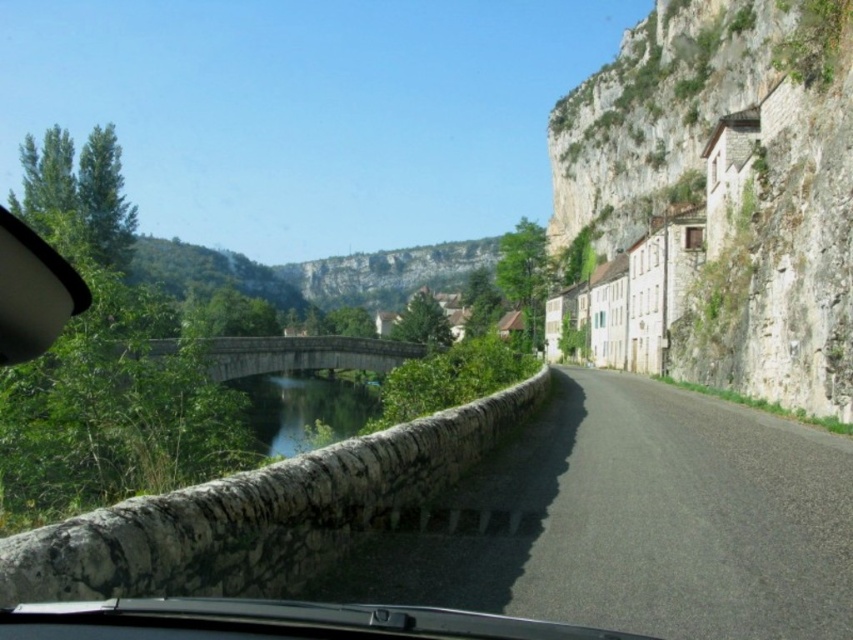
Between white stone houses at right and stone bridge at center, which one is positioned lower?

stone bridge at center

Can you confirm if white stone houses at right is bigger than stone bridge at center?

Indeed, white stone houses at right has a larger size compared to stone bridge at center.

Who is more distant from viewer, (763, 388) or (210, 372)?

The point (763, 388) is more distant.

Where is `white stone houses at right`? white stone houses at right is located at coordinates (727, 189).

Find the location of a particular element. The image size is (853, 640). clear water at bridge center is located at coordinates (303, 410).

Image resolution: width=853 pixels, height=640 pixels. Describe the element at coordinates (303, 410) in the screenshot. I see `clear water at bridge center` at that location.

Based on the photo, who is more distant from viewer, (347, 419) or (248, 337)?

Point (248, 337)

What are the coordinates of `clear water at bridge center` in the screenshot? It's located at (303, 410).

Between asphalt road at center and stone bridge at center, which one has less height?

asphalt road at center

Who is taller, asphalt road at center or stone bridge at center?

stone bridge at center is taller.

Locate an element on the screen. The image size is (853, 640). asphalt road at center is located at coordinates (636, 522).

You are a GUI agent. You are given a task and a screenshot of the screen. Output one action in this format:
    pyautogui.click(x=<x>, y=<y>)
    Task: Click on the asphalt road at center
    
    Given the screenshot: What is the action you would take?
    pyautogui.click(x=636, y=522)